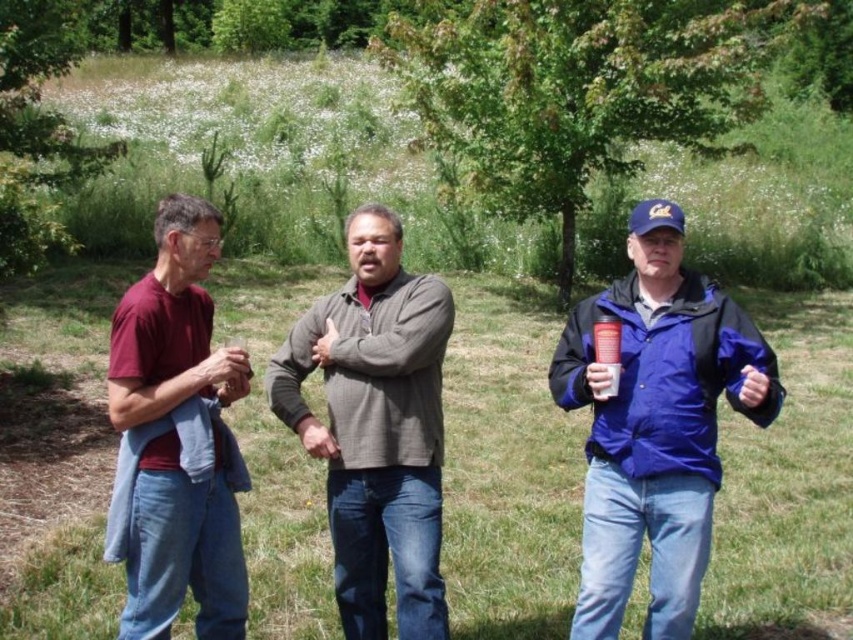
In the scene, there are a maroon fabric shirt at left and a metallic silver cup at right. Which object is positioned more to the left?

The maroon fabric shirt at left is positioned more to the left than the metallic silver cup at right.

You are standing at the point labeled as point (656,424) in the image. What object is located at that point?

The point (656,424) corresponds to the blue matte jacket at right.